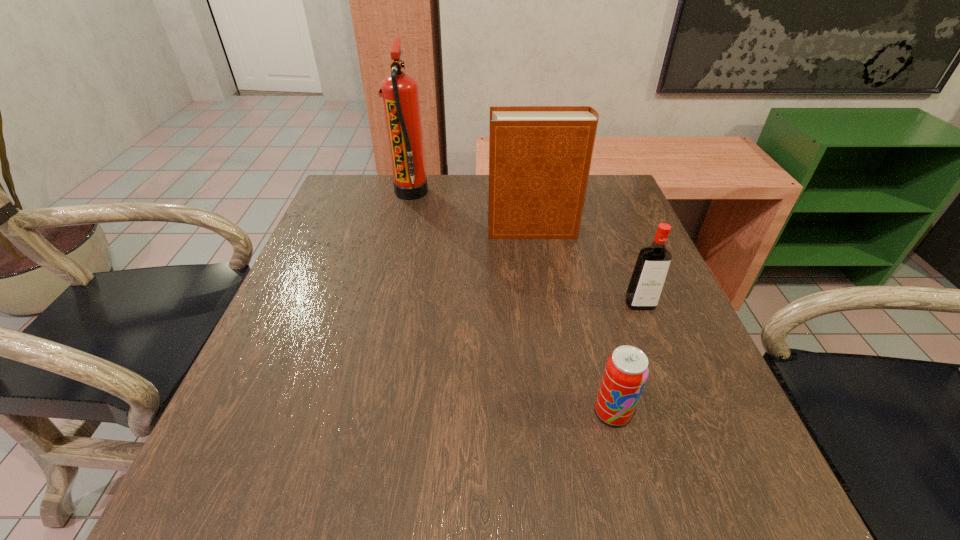
This screenshot has width=960, height=540. Find the location of `free location that satisfies the following two spatial constraints: 1. with the nozzle pointing from the back of the tallest object; 2. on the right side of the nearest object`. free location that satisfies the following two spatial constraints: 1. with the nozzle pointing from the back of the tallest object; 2. on the right side of the nearest object is located at coordinates (360, 412).

At what (x,y) coordinates should I click in order to perform the action: click on free space that satisfies the following two spatial constraints: 1. with the nozzle pointing from the back of the leftmost object; 2. on the right side of the shortest object. Please return your answer as a coordinate pair (x, y). The image size is (960, 540). Looking at the image, I should click on (360, 412).

Identify the location of vacant space that satisfies the following two spatial constraints: 1. with the nozzle pointing from the back of the leftmost object; 2. on the back side of the nearest object. (360, 412).

What are the coordinates of `vacant area in the image that satisfies the following two spatial constraints: 1. on the back side of the shortest object; 2. with the nozzle pointing from the back of the farthest object` in the screenshot? It's located at (557, 192).

Identify the location of vacant position in the image that satisfies the following two spatial constraints: 1. with the nozzle pointing from the back of the tallest object; 2. on the back side of the shortest object. (360, 412).